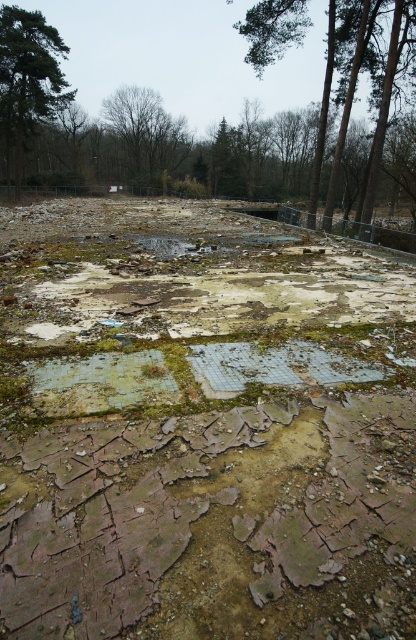
Is brown wood tree at upper center smaller than green leafy tree at upper left?

Incorrect, brown wood tree at upper center is not smaller in size than green leafy tree at upper left.

Is brown wood tree at upper center to the left of green leafy tree at upper left from the viewer's perspective?

No, brown wood tree at upper center is not to the left of green leafy tree at upper left.

Locate an element on the screen. brown wood tree at upper center is located at coordinates (356, 77).

Is brown wood tree at upper center further to camera compared to brown leafless tree at upper center?

No, it is not.

Find the location of `brown wood tree at upper center`. brown wood tree at upper center is located at coordinates (356, 77).

At what (x,y) coordinates should I click in order to perform the action: click on brown wood tree at upper center. Please return your answer as a coordinate pair (x, y). Looking at the image, I should click on [356, 77].

Who is more forward, (14, 35) or (148, 170)?

Point (14, 35)

This screenshot has height=640, width=416. I want to click on green leafy tree at upper left, so click(27, 83).

Where is `green leafy tree at upper left`? green leafy tree at upper left is located at coordinates (27, 83).